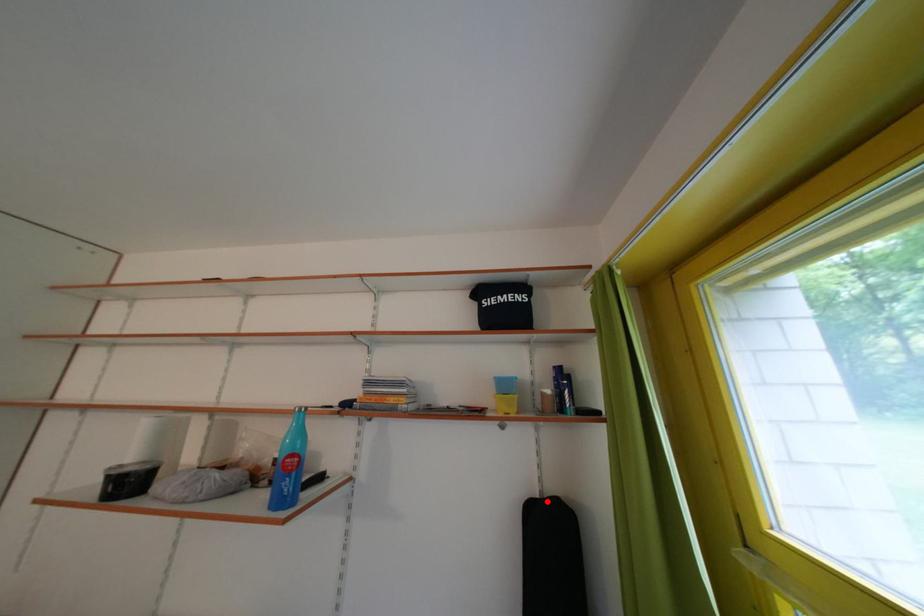
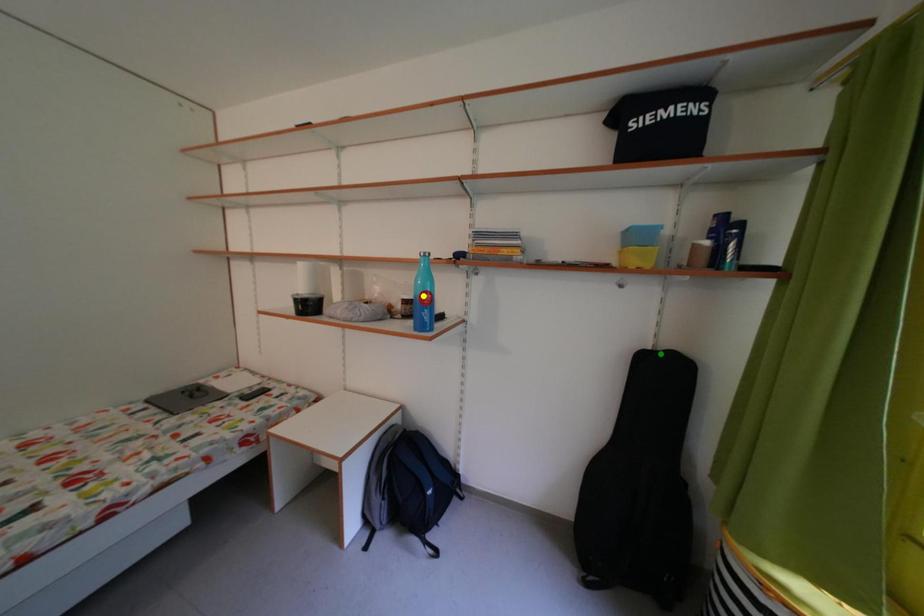
Question: I am providing you with two images of the same scene from different viewpoints. A red point is marked on the first image. You are given multiple points on the second image. Which spot in image 2 lines up with the point in image 1?

Choices:
 (A) green point
 (B) blue point
 (C) yellow point

Answer: (A)